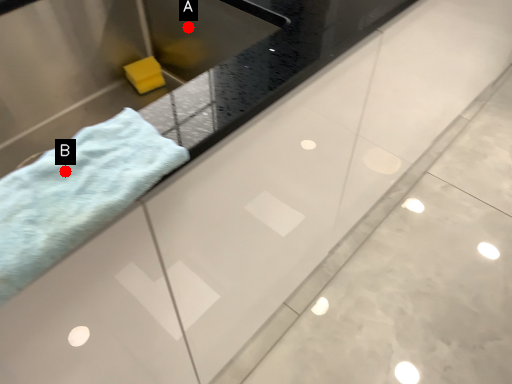
Question: Two points are circled on the image, labeled by A and B beside each circle. Which of the following is the farthest from the observer?

Choices:
 (A) A is further
 (B) B is further

Answer: (A)